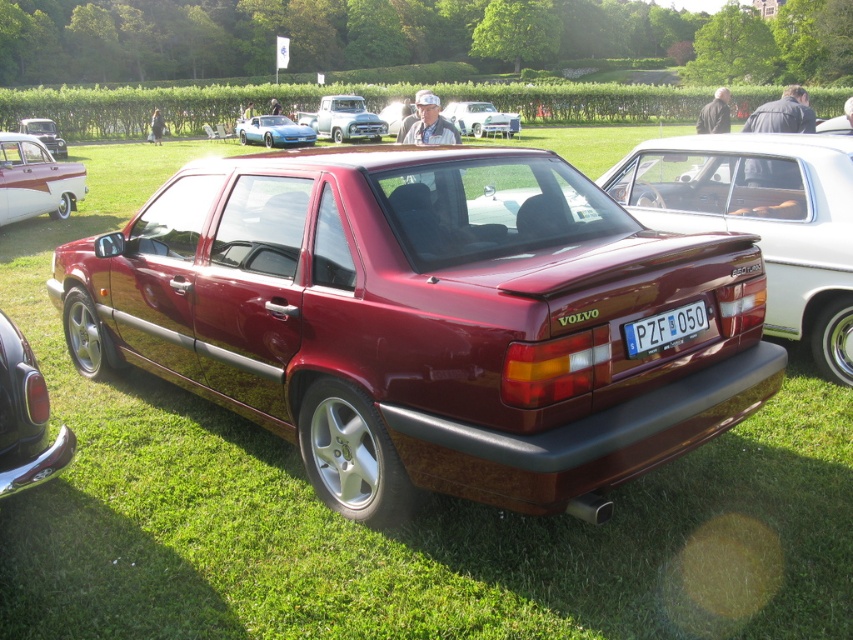
Does point (158, 266) come in front of point (851, 358)?

Yes.

Can you confirm if satin burgundy car at center is taller than glossy maroon sedan at center?

A: Indeed, satin burgundy car at center has a greater height compared to glossy maroon sedan at center.

Is point (599, 412) less distant than point (688, 225)?

Yes, point (599, 412) is closer to viewer.

What are the coordinates of `satin burgundy car at center` in the screenshot? It's located at (425, 321).

Measure the distance between point [4,323] and camera.

Point [4,323] and camera are 3.48 meters apart.

Is point (32, 481) in front of point (351, 125)?

Yes, point (32, 481) is closer to viewer.

Is point (47, 413) farther from viewer compared to point (337, 109)?

No, (47, 413) is closer to viewer.

What are the coordinates of `glossy chrome bumper at lower left` in the screenshot? It's located at (25, 417).

Between point (699, 186) and point (462, 113), which one is positioned in front?

Point (699, 186)

Can you confirm if glossy maroon sedan at center is shorter than metallic silver sedan at upper center?

Indeed, glossy maroon sedan at center has a lesser height compared to metallic silver sedan at upper center.

Identify the location of glossy maroon sedan at center. (761, 220).